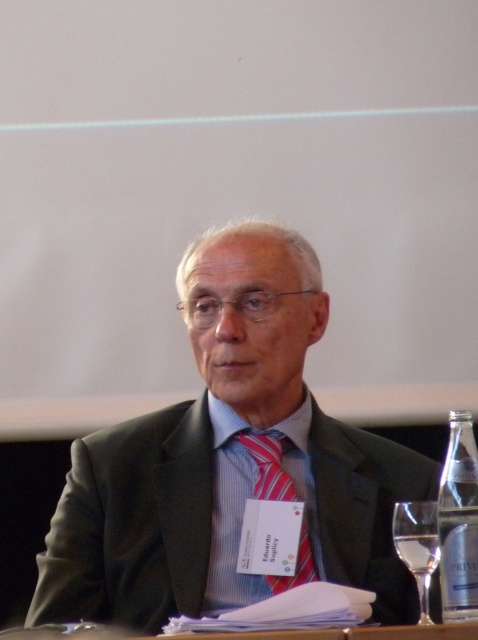
Question: Which point is closer to the camera?

Choices:
 (A) matte black suit at center
 (B) clear glass wine glass at lower right
 (C) clear glass bottle at lower right
 (D) striped silk tie at center

Answer: (C)

Question: Which point is closer to the camera?

Choices:
 (A) (264, 486)
 (B) (451, 509)
 (C) (400, 536)
 (D) (270, 472)

Answer: (B)

Question: Which object appears farthest from the camera in this image?

Choices:
 (A) clear glass wine glass at lower right
 (B) striped silk tie at center

Answer: (B)

Question: Is the position of matte black suit at center more distant than that of clear glass bottle at lower right?

Choices:
 (A) yes
 (B) no

Answer: (A)

Question: Observing the image, what is the correct spatial positioning of matte black suit at center in reference to striped silk tie at center?

Choices:
 (A) right
 (B) left

Answer: (B)

Question: Is clear glass bottle at lower right to the right of striped silk tie at center from the viewer's perspective?

Choices:
 (A) yes
 (B) no

Answer: (A)